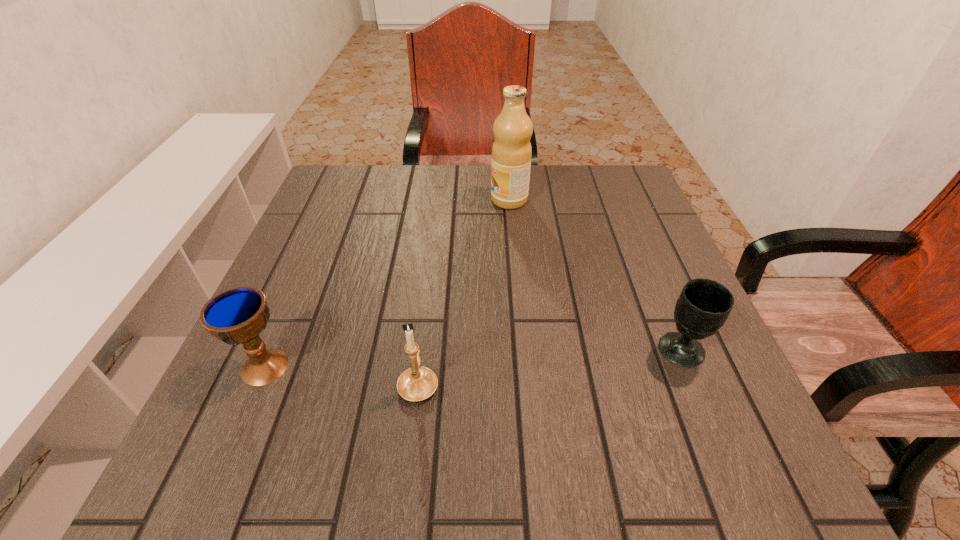
Where is `vacant position in the image that satisfies the following two spatial constraints: 1. on the label of the farthest object; 2. on the right side of the right chalice`? vacant position in the image that satisfies the following two spatial constraints: 1. on the label of the farthest object; 2. on the right side of the right chalice is located at coordinates 522,350.

You are a GUI agent. You are given a task and a screenshot of the screen. Output one action in this format:
    pyautogui.click(x=<x>, y=<y>)
    Task: Click on the blank area in the image that satisfies the following two spatial constraints: 1. on the back side of the right chalice; 2. on the right side of the left chalice
    Image resolution: width=960 pixels, height=540 pixels.
    Given the screenshot: What is the action you would take?
    pyautogui.click(x=272, y=350)